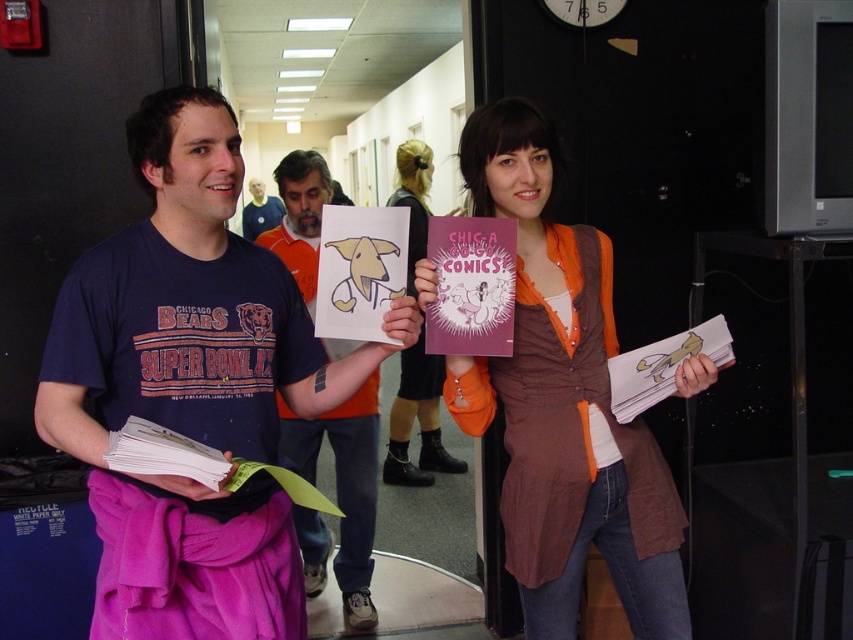
Does point (94, 490) lie in front of point (393, 412)?

Yes, point (94, 490) is closer to viewer.

Does matte blue t-shirt at center appear over matte pink skirt at center?

Yes.

Does point (165, 476) come closer to viewer compared to point (407, 196)?

Yes, it is in front of point (407, 196).

This screenshot has height=640, width=853. In order to click on matte blue t-shirt at center in this screenshot , I will do tap(189, 388).

Is brown fabric shirt at center behind matte pink skirt at center?

That is False.

Is point (573, 396) behind point (419, 156)?

No, (573, 396) is in front of (419, 156).

This screenshot has width=853, height=640. What are the coordinates of `brown fabric shirt at center` in the screenshot? It's located at (563, 401).

Who is taller, matte paper dog drawing at center or orange t-shirt at center?

Standing taller between the two is matte paper dog drawing at center.

Where is `matte paper dog drawing at center`? This screenshot has height=640, width=853. matte paper dog drawing at center is located at coordinates (344, 484).